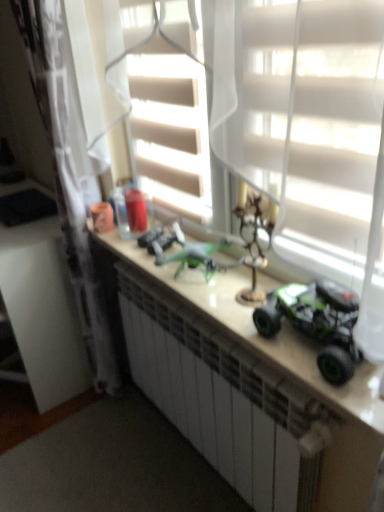
Question: From the image's perspective, is green plastic toy car at center above or below green matte toy car at center, which ranks as the 3th toy in front-to-back order?

Choices:
 (A) below
 (B) above

Answer: (A)

Question: Considering the relative positions of green plastic toy car at center and green matte toy car at center, which ranks as the 3th toy in front-to-back order, in the image provided, is green plastic toy car at center to the left or to the right of green matte toy car at center, which ranks as the 3th toy in front-to-back order,?

Choices:
 (A) right
 (B) left

Answer: (A)

Question: Which object is positioned closest to the white glossy vanity at left?

Choices:
 (A) green plastic toy car at center
 (B) metallic green drone at center, positioned as the 2th toy in front-to-back order
 (C) green matte toy car at right, the first toy positioned from the front
 (D) green matte toy car at center, which ranks as the 3th toy in front-to-back order
 (E) white sheer curtain at left

Answer: (E)

Question: Based on their relative distances, which object is farther from the metallic green drone at center, the second toy in the right-to-left sequence?

Choices:
 (A) white sheer curtain at left
 (B) green plastic toy car at center
 (C) green matte toy car at right, which is counted as the 3th toy, starting from the back
 (D) green matte toy car at center, the third toy from the right
 (E) white glossy vanity at left

Answer: (E)